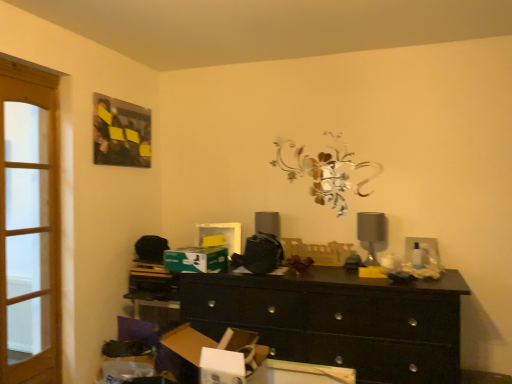
Question: From a real-world perspective, is cardboard box at lower left, arranged as the first cardboard box when viewed from the front, physically located above or below light brown wooden screen door at left?

Choices:
 (A) below
 (B) above

Answer: (A)

Question: Looking at the image, does cardboard box at lower left, positioned as the 2th cardboard box in top-to-bottom order, seem bigger or smaller compared to light brown wooden screen door at left?

Choices:
 (A) small
 (B) big

Answer: (B)

Question: Considering the real-world distances, which object is closest to the light brown wooden screen door at left?

Choices:
 (A) yellow plastic tray at center
 (B) green cardboard box at center, arranged as the 1th cardboard box when viewed from the back
 (C) black wood chest of drawers at center
 (D) cardboard box at lower left, marked as the 2th cardboard box in a back-to-front arrangement
 (E) matte black table lamp at right

Answer: (B)

Question: Considering the real-world distances, which object is closest to the matte black table lamp at right?

Choices:
 (A) green cardboard box at center, arranged as the 1th cardboard box when viewed from the back
 (B) yellow plastic tray at center
 (C) light brown wooden screen door at left
 (D) black wood chest of drawers at center
 (E) cardboard box at lower left, the first cardboard box in the bottom-to-top sequence

Answer: (B)